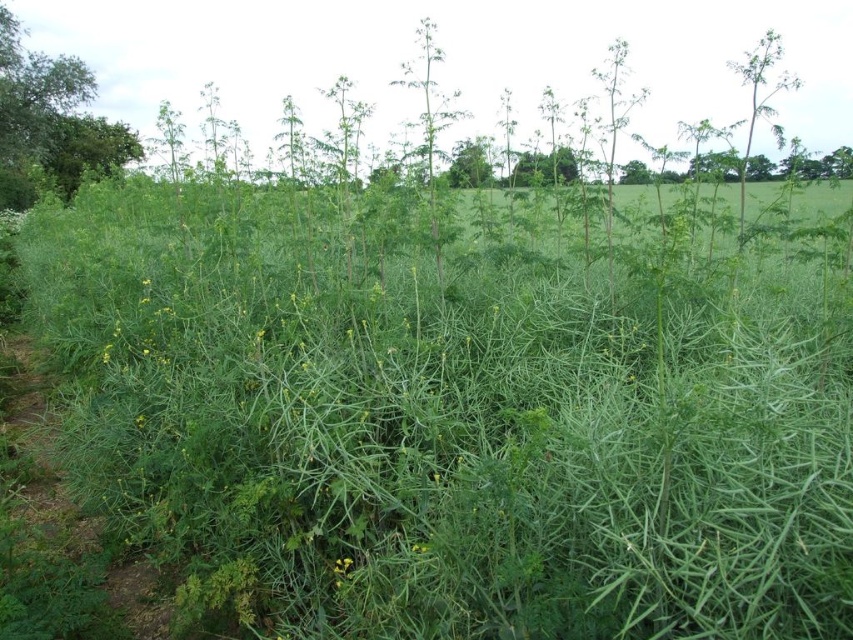
Question: Is green leafy grass at center wider than green leafy tree at upper left?

Choices:
 (A) no
 (B) yes

Answer: (B)

Question: Does green leafy grass at center appear on the right side of green leafy tree at upper left?

Choices:
 (A) yes
 (B) no

Answer: (A)

Question: Which point is closer to the camera taking this photo?

Choices:
 (A) (53, 188)
 (B) (740, 356)

Answer: (B)

Question: Which point is closer to the camera taking this photo?

Choices:
 (A) (x=502, y=256)
 (B) (x=38, y=166)

Answer: (A)

Question: Is green leafy grass at center bigger than green leafy tree at upper left?

Choices:
 (A) yes
 (B) no

Answer: (A)